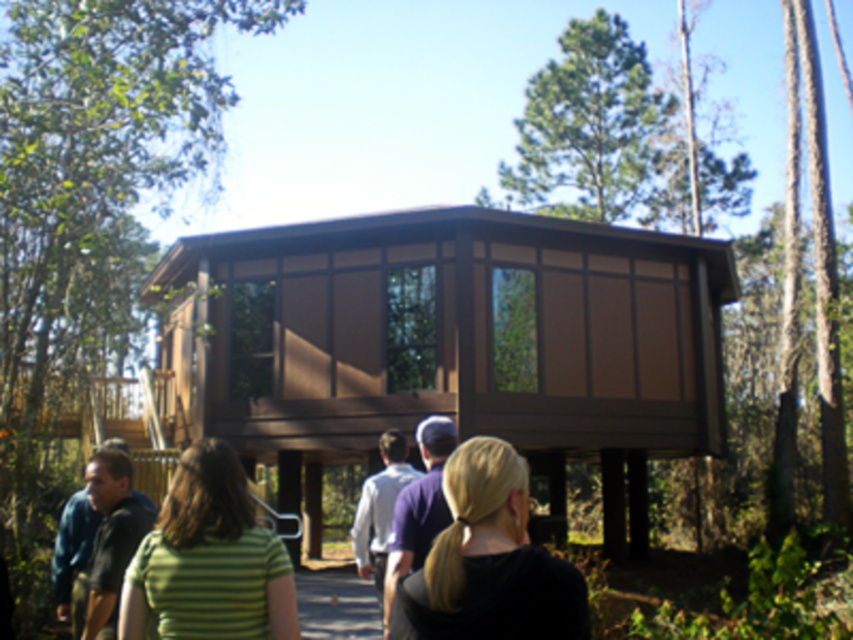
Question: Can you confirm if green striped shirt at center is positioned to the right of white cotton shirt at center?

Choices:
 (A) no
 (B) yes

Answer: (A)

Question: Can you confirm if green leafy tree at upper center is bigger than white cotton shirt at center?

Choices:
 (A) yes
 (B) no

Answer: (A)

Question: Which of the following is the closest to the observer?

Choices:
 (A) dark green shirt at lower left
 (B) green leafy tree at upper center

Answer: (A)

Question: Is green leafy tree at upper left to the right of green leafy tree at upper center from the viewer's perspective?

Choices:
 (A) no
 (B) yes

Answer: (A)

Question: Among these objects, which one is nearest to the camera?

Choices:
 (A) green leafy tree at upper center
 (B) blonde hair at center
 (C) green leafy tree at upper left

Answer: (B)

Question: Which object is closer to the camera taking this photo?

Choices:
 (A) green striped shirt at center
 (B) white cotton shirt at center

Answer: (A)